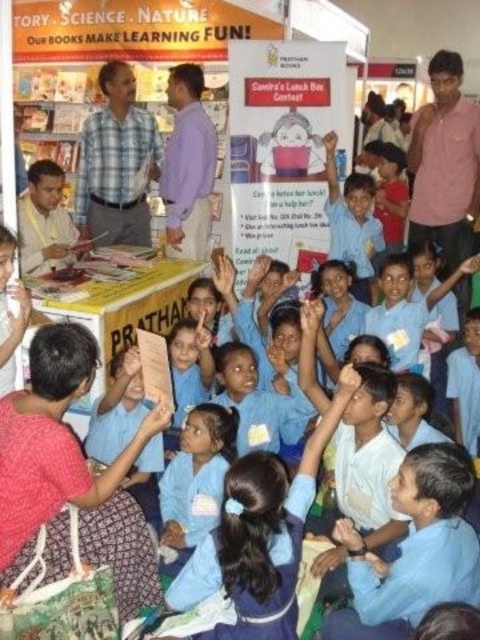
Which of these two, pink cotton shirt at upper right or light blue plaid shirt at center, stands taller?

pink cotton shirt at upper right is taller.

Is pink cotton shirt at upper right bigger than light blue plaid shirt at center?

Yes.

Is point (465, 232) behind point (87, 221)?

No, it is not.

The width and height of the screenshot is (480, 640). I want to click on pink cotton shirt at upper right, so click(444, 163).

Can you confirm if blue uniform shirt at center is positioned below purple shirt at center?

Indeed, blue uniform shirt at center is positioned under purple shirt at center.

Based on the photo, how distant is blue uniform shirt at center from purple shirt at center?

They are 3.16 meters apart.

What do you see at coordinates (412, 550) in the screenshot?
I see `blue uniform shirt at center` at bounding box center [412, 550].

At what (x,y) coordinates should I click in order to perform the action: click on blue uniform shirt at center. Please return your answer as a coordinate pair (x, y). Looking at the image, I should click on (412, 550).

Can you confirm if blue uniform shirt at center is positioned below light blue plaid shirt at center?

Indeed, blue uniform shirt at center is positioned under light blue plaid shirt at center.

Between point (440, 593) and point (88, 161), which one is positioned behind?

The point (88, 161) is more distant.

This screenshot has height=640, width=480. I want to click on blue uniform shirt at center, so click(x=412, y=550).